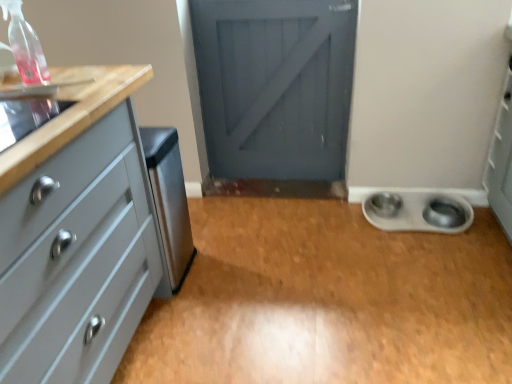
What is the approximate width of silver metallic bowls at lower right, which is the 1th appliance from back to front?

It is 26.85 centimeters.

This screenshot has height=384, width=512. Describe the element at coordinates (418, 212) in the screenshot. I see `silver metallic bowls at lower right, which is the 1th appliance from back to front` at that location.

At what (x,y) coordinates should I click in order to perform the action: click on stainless steel trash can at left, which is counted as the 2th appliance, starting from the back. Please return your answer as a coordinate pair (x, y). The height and width of the screenshot is (384, 512). Looking at the image, I should click on (169, 203).

You are a GUI agent. You are given a task and a screenshot of the screen. Output one action in this format:
    pyautogui.click(x=<x>, y=<y>)
    Task: Click on the silver metallic bowls at lower right, which is the 1th appliance from back to front
    
    Given the screenshot: What is the action you would take?
    [418, 212]

From the image's perspective, is silver metallic bowls at lower right, which ranks as the 1th appliance in right-to-left order, under clear plastic spray bottle at upper left?

Indeed, from the image's perspective, silver metallic bowls at lower right, which ranks as the 1th appliance in right-to-left order, is shown beneath clear plastic spray bottle at upper left.

Is point (433, 197) positioned before point (14, 8)?

No, it is not.

Is silver metallic bowls at lower right, arranged as the second appliance when viewed from the front, far away from clear plastic spray bottle at upper left?

silver metallic bowls at lower right, arranged as the second appliance when viewed from the front, is positioned a significant distance from clear plastic spray bottle at upper left.

From a real-world perspective, who is located higher, silver metallic bowls at lower right, arranged as the second appliance when viewed from the front, or clear plastic spray bottle at upper left?

In real-world perspective, clear plastic spray bottle at upper left is above.

The width and height of the screenshot is (512, 384). What are the coordinates of `the chest of drawers positioned vertically above the silver metallic bowls at lower right, arranged as the second appliance when viewed from the front (from a real-world perspective)` in the screenshot? It's located at (77, 259).

How far apart are matte gray chest of drawers at left and silver metallic bowls at lower right, arranged as the second appliance when viewed from the front?

They are 1.39 meters apart.

Based on the photo, which of these two, matte gray chest of drawers at left or silver metallic bowls at lower right, acting as the second appliance starting from the left, is wider?

With larger width is matte gray chest of drawers at left.

Considering the points (8, 205) and (373, 215), which point is behind, point (8, 205) or point (373, 215)?

The point (373, 215) is farther from the camera.

Looking at this image, is stainless steel trash can at left, the 2th appliance viewed from the right, a part of clear plastic spray bottle at upper left?

That's incorrect, stainless steel trash can at left, the 2th appliance viewed from the right, is not inside clear plastic spray bottle at upper left.

From the picture: Can you confirm if clear plastic spray bottle at upper left is taller than stainless steel trash can at left, which is counted as the 2th appliance, starting from the back?

No, clear plastic spray bottle at upper left is not taller than stainless steel trash can at left, which is counted as the 2th appliance, starting from the back.

From the image's perspective, which is below, clear plastic spray bottle at upper left or stainless steel trash can at left, the 2th appliance viewed from the right?

stainless steel trash can at left, the 2th appliance viewed from the right, appears lower in the image.

Would you consider clear plastic spray bottle at upper left to be distant from stainless steel trash can at left, acting as the first appliance starting from the front?

clear plastic spray bottle at upper left is actually quite close to stainless steel trash can at left, acting as the first appliance starting from the front.

Would you say metallic silver bowls at lower right is a long distance from silver metallic bowls at lower right, which ranks as the 1th appliance in right-to-left order?

Actually, metallic silver bowls at lower right and silver metallic bowls at lower right, which ranks as the 1th appliance in right-to-left order, are a little close together.

From a real-world perspective, does metallic silver bowls at lower right stand above silver metallic bowls at lower right, which is the 1th appliance from back to front?

Actually, metallic silver bowls at lower right is physically below silver metallic bowls at lower right, which is the 1th appliance from back to front, in the real world.

Based on the photo, is metallic silver bowls at lower right facing away from silver metallic bowls at lower right, arranged as the second appliance when viewed from the front?

metallic silver bowls at lower right is not turned away from silver metallic bowls at lower right, arranged as the second appliance when viewed from the front.

Is point (486, 337) farther from camera compared to point (384, 200)?

No, (486, 337) is closer to viewer.

Consider the image. Is silver metallic bowls at lower right, acting as the second appliance starting from the left, in contact with stainless steel trash can at left, acting as the first appliance starting from the front?

silver metallic bowls at lower right, acting as the second appliance starting from the left, is not next to stainless steel trash can at left, acting as the first appliance starting from the front, and they're not touching.

From a real-world perspective, which is physically below, silver metallic bowls at lower right, which ranks as the 1th appliance in right-to-left order, or stainless steel trash can at left, which is the 1th appliance from left to right?

silver metallic bowls at lower right, which ranks as the 1th appliance in right-to-left order, is physically lower.

Does silver metallic bowls at lower right, arranged as the second appliance when viewed from the front, have a lesser height compared to stainless steel trash can at left, acting as the first appliance starting from the front?

Correct, silver metallic bowls at lower right, arranged as the second appliance when viewed from the front, is not as tall as stainless steel trash can at left, acting as the first appliance starting from the front.

Identify the location of appliance lying on the left of silver metallic bowls at lower right, arranged as the second appliance when viewed from the front. This screenshot has width=512, height=384. (169, 203).

Which is further, (x=124, y=131) or (x=36, y=62)?

The point (x=124, y=131) is farther.

Consider the image. How different are the orientations of matte gray chest of drawers at left and clear plastic spray bottle at upper left in degrees?

The angular difference between matte gray chest of drawers at left and clear plastic spray bottle at upper left is 87.4 degrees.

In the scene shown: Could you tell me if matte gray chest of drawers at left is facing clear plastic spray bottle at upper left?

Answer: No, matte gray chest of drawers at left does not turn towards clear plastic spray bottle at upper left.

In the scene shown: Which object is closer to the camera, matte gray chest of drawers at left or clear plastic spray bottle at upper left?

matte gray chest of drawers at left is more forward.

Is clear plastic spray bottle at upper left spatially inside matte gray chest of drawers at left, or outside of it?

The correct answer is: outside.

In the scene shown: Is clear plastic spray bottle at upper left turned away from matte gray chest of drawers at left?

No.

Looking at this image, from the image's perspective, who appears lower, clear plastic spray bottle at upper left or matte gray chest of drawers at left?

matte gray chest of drawers at left, from the image's perspective.

Which appliance is the 2nd one when counting from the back of the clear plastic spray bottle at upper left? Please provide its 2D coordinates.

[(418, 212)]

Locate an element on the screen. appliance that is the 2nd object directly below the matte gray chest of drawers at left (from a real-world perspective) is located at coordinates (418, 212).

Based on their spatial positions, is clear plastic spray bottle at upper left or metallic silver bowl at lower right closer to matte gray chest of drawers at left?

Among the two, clear plastic spray bottle at upper left is located nearer to matte gray chest of drawers at left.

When comparing their distances from clear plastic spray bottle at upper left, does silver metallic bowls at lower right, acting as the second appliance starting from the left, or metallic silver bowls at lower right seem further?

Based on the image, silver metallic bowls at lower right, acting as the second appliance starting from the left, appears to be further to clear plastic spray bottle at upper left.

When comparing their distances from matte gray chest of drawers at left, does clear plastic spray bottle at upper left or stainless steel trash can at left, which is the 1th appliance from left to right, seem further?

The object further to matte gray chest of drawers at left is clear plastic spray bottle at upper left.

When comparing their distances from stainless steel trash can at left, which is counted as the 2th appliance, starting from the back, does clear plastic spray bottle at upper left or metallic silver bowls at lower right seem further?

Among the two, clear plastic spray bottle at upper left is located further to stainless steel trash can at left, which is counted as the 2th appliance, starting from the back.

Consider the image. Estimate the real-world distances between objects in this image. Which object is further from silver metallic bowls at lower right, acting as the second appliance starting from the left, matte gray chest of drawers at left or metallic silver bowl at lower right?

matte gray chest of drawers at left lies further to silver metallic bowls at lower right, acting as the second appliance starting from the left, than the other object.

Based on their spatial positions, is clear plastic spray bottle at upper left or metallic silver bowl at lower right closer to silver metallic bowls at lower right, which ranks as the 1th appliance in right-to-left order?

Among the two, metallic silver bowl at lower right is located nearer to silver metallic bowls at lower right, which ranks as the 1th appliance in right-to-left order.

Based on their spatial positions, is stainless steel trash can at left, the 2th appliance viewed from the right, or silver metallic bowls at lower right, which is the 1th appliance from back to front, further from metallic silver bowls at lower right?

stainless steel trash can at left, the 2th appliance viewed from the right, is positioned further to the anchor metallic silver bowls at lower right.

When comparing their distances from metallic silver bowl at lower right, does silver metallic bowls at lower right, arranged as the second appliance when viewed from the front, or clear plastic spray bottle at upper left seem further?

Based on the image, clear plastic spray bottle at upper left appears to be further to metallic silver bowl at lower right.

Locate an element on the screen. This screenshot has height=384, width=512. plain between clear plastic spray bottle at upper left and metallic silver bowl at lower right is located at coordinates (328, 301).

Image resolution: width=512 pixels, height=384 pixels. What are the coordinates of `plain located between matte gray chest of drawers at left and metallic silver bowl at lower right in the depth direction` in the screenshot? It's located at (328, 301).

Locate an element on the screen. knob between matte gray chest of drawers at left and silver metallic bowls at lower right, acting as the second appliance starting from the left, from left to right is located at coordinates (385, 204).

Find the location of a particular element. This screenshot has width=512, height=384. the chest of drawers situated between clear plastic spray bottle at upper left and metallic silver bowl at lower right from left to right is located at coordinates (77, 259).